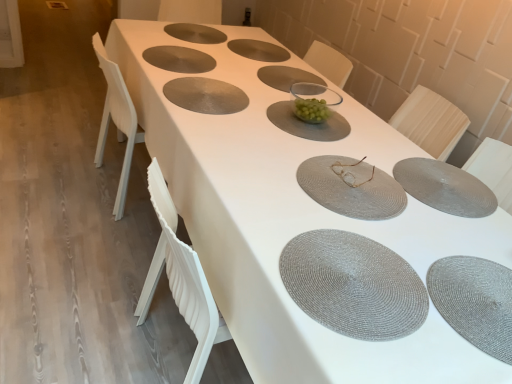
Find the location of a particular element. The width and height of the screenshot is (512, 384). vacant space behind matte gray placemat at center, which is counted as the third tableware, starting from the bottom is located at coordinates (339, 139).